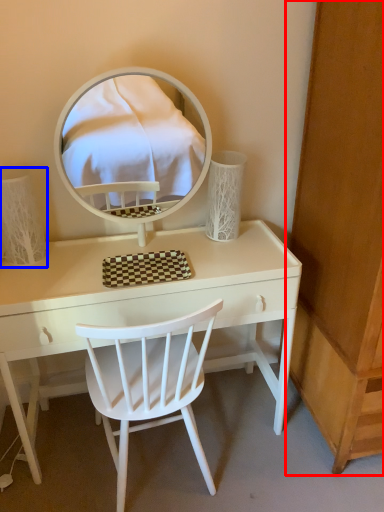
Question: Which object appears farthest to the camera in this image, dresser (highlighted by a red box) or table lamp (highlighted by a blue box)?

Choices:
 (A) dresser
 (B) table lamp

Answer: (B)